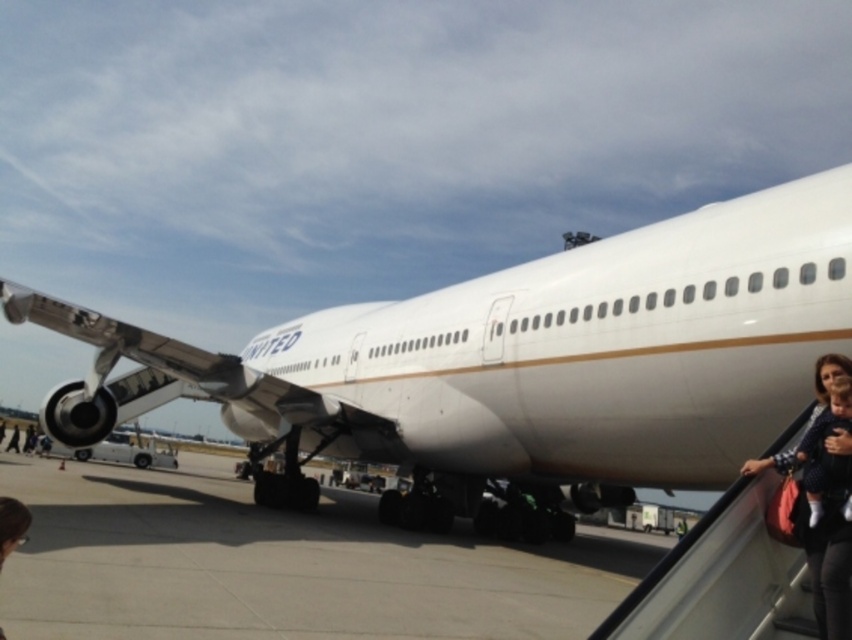
Question: Among these points, which one is nearest to the camera?

Choices:
 (A) (726, 321)
 (B) (801, 529)

Answer: (B)

Question: Does white glossy airplane at center have a larger size compared to dark brown hair at lower left?

Choices:
 (A) no
 (B) yes

Answer: (B)

Question: Which point is farther to the camera?

Choices:
 (A) (1, 545)
 (B) (256, 342)
 (C) (818, 595)

Answer: (B)

Question: Does gray concrete tarmac at center come behind dark brown hair at lower left?

Choices:
 (A) no
 (B) yes

Answer: (B)

Question: Which point is closer to the camera?

Choices:
 (A) dark brown hair at lower left
 (B) matte black dress at lower right

Answer: (A)

Question: Does white glossy airplane at center have a lesser width compared to matte black dress at lower right?

Choices:
 (A) yes
 (B) no

Answer: (B)